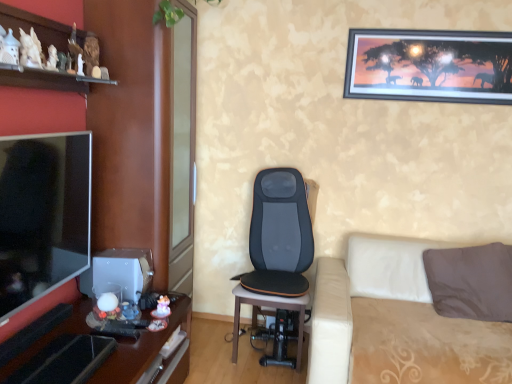
Question: In the image, is matte black tv at left on the left side or the right side of white ceramic figurines at upper left?

Choices:
 (A) right
 (B) left

Answer: (B)

Question: Considering the positions of matte black tv at left and white ceramic figurines at upper left in the image, is matte black tv at left taller or shorter than white ceramic figurines at upper left?

Choices:
 (A) short
 (B) tall

Answer: (B)

Question: Which is nearer to the matte black tv at left?

Choices:
 (A) matte wood entertainment center at left
 (B) matte white figurine at lower center
 (C) beige fabric studio couch at lower right
 (D) black leather massage chair at center
 (E) white ceramic figurines at upper left

Answer: (A)

Question: Which object is positioned closest to the matte white figurine at lower center?

Choices:
 (A) white ceramic figurines at upper left
 (B) matte black tv at left
 (C) wooden glossy desk at left
 (D) metallic-framed picture at upper right
 (E) black leather massage chair at center

Answer: (C)